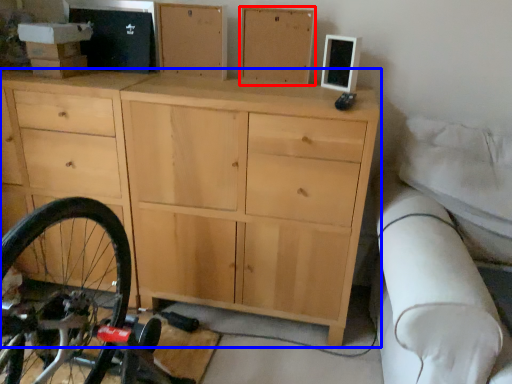
Question: Which of the following is the farthest to the observer, chest of drawer (highlighted by a red box) or chest of drawers (highlighted by a blue box)?

Choices:
 (A) chest of drawer
 (B) chest of drawers

Answer: (A)